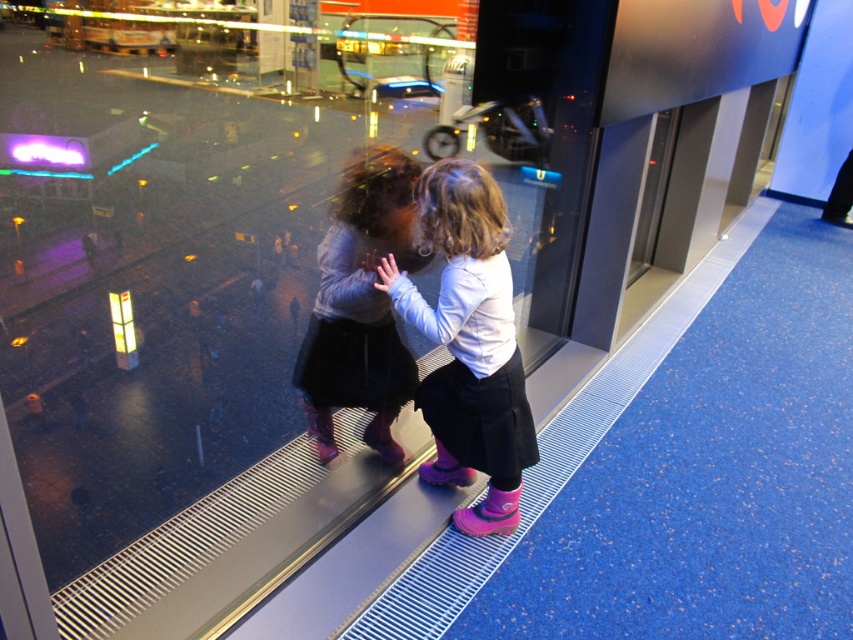
Does pink rubber boots at center appear on the right side of matte gray sweater at center?

Correct, you'll find pink rubber boots at center to the right of matte gray sweater at center.

Locate an element on the screen. The height and width of the screenshot is (640, 853). pink rubber boots at center is located at coordinates (469, 344).

You are a GUI agent. You are given a task and a screenshot of the screen. Output one action in this format:
    pyautogui.click(x=<x>, y=<y>)
    Task: Click on the pink rubber boots at center
    This screenshot has width=853, height=640.
    Given the screenshot: What is the action you would take?
    pyautogui.click(x=469, y=344)